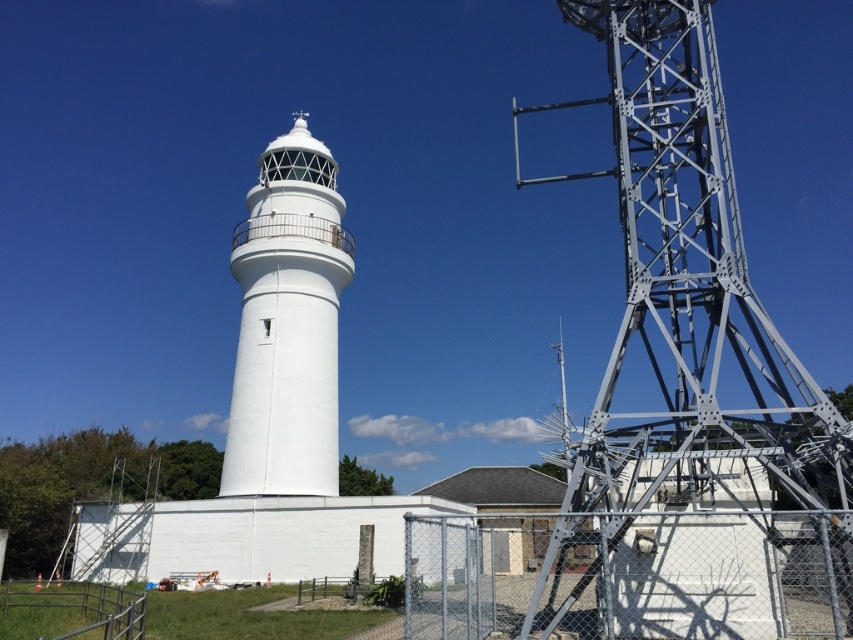
Can you confirm if chain-link fence at lower right is positioned to the right of white smooth lighthouse at center?

Yes, chain-link fence at lower right is to the right of white smooth lighthouse at center.

What do you see at coordinates (630, 576) in the screenshot? I see `chain-link fence at lower right` at bounding box center [630, 576].

Does point (750, 627) lie in front of point (242, 320)?

Yes, point (750, 627) is closer to viewer.

The image size is (853, 640). What are the coordinates of `chain-link fence at lower right` in the screenshot? It's located at (630, 576).

Can you confirm if white smooth lighthouse at center is smaller than metallic silver fence at lower left?

Actually, white smooth lighthouse at center might be larger than metallic silver fence at lower left.

From the picture: Who is lower down, white smooth lighthouse at center or metallic silver fence at lower left?

Positioned lower is metallic silver fence at lower left.

Does point (225, 449) lie behind point (132, 595)?

Yes, point (225, 449) is behind point (132, 595).

Identify the location of white smooth lighthouse at center. (287, 323).

Is point (750, 474) closer to viewer compared to point (291, 136)?

That is True.

Can you confirm if metallic gray tower at right is positioned above white smooth lighthouse at center?

No.

Where is `metallic gray tower at right`? This screenshot has width=853, height=640. metallic gray tower at right is located at coordinates (689, 291).

The width and height of the screenshot is (853, 640). In order to click on metallic gray tower at right in this screenshot , I will do `click(689, 291)`.